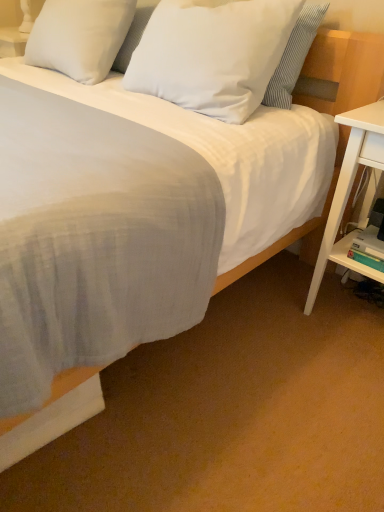
In order to click on vacant area that is in front of white wood nightstand at right in this screenshot , I will do `click(335, 374)`.